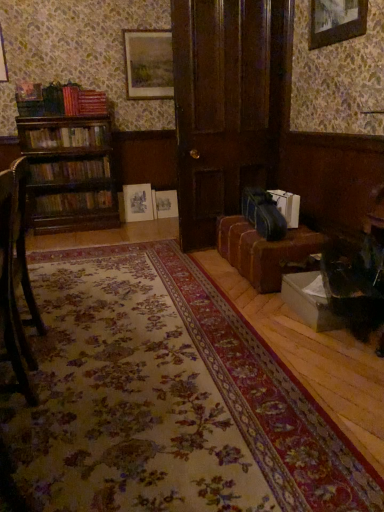
Find the location of a particular element. blank area beneath wooden bookshelf at left, the third book viewed from the right (from a real-world perspective) is located at coordinates (77, 190).